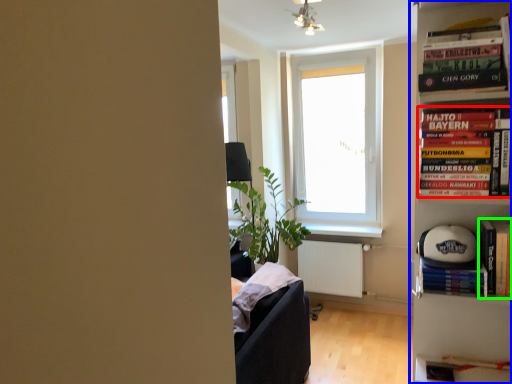
Question: Which object is the closest to the book (highlighted by a red box)? Choose among these: bookcase (highlighted by a blue box) or book (highlighted by a green box).

Choices:
 (A) bookcase
 (B) book

Answer: (B)